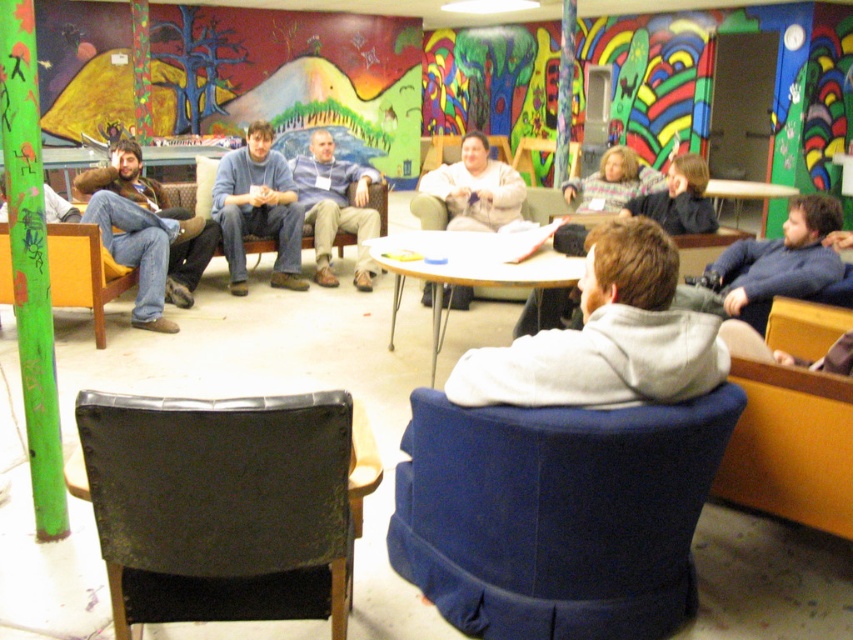
Between black leather swivel chair at lower left and matte blue jeans at center, which one is positioned higher?

matte blue jeans at center is higher up.

Between black leather swivel chair at lower left and matte blue jeans at center, which one has less height?

Standing shorter between the two is black leather swivel chair at lower left.

Is point (334, 593) more distant than point (328, 272)?

No, it is in front of (328, 272).

The image size is (853, 640). I want to click on black leather swivel chair at lower left, so click(x=222, y=504).

Can you confirm if black leather swivel chair at lower left is positioned below white glossy table at center?

Yes.

Does point (218, 424) lie behind point (727, 189)?

No, it is not.

Image resolution: width=853 pixels, height=640 pixels. Describe the element at coordinates (222, 504) in the screenshot. I see `black leather swivel chair at lower left` at that location.

This screenshot has height=640, width=853. Find the location of `black leather swivel chair at lower left`. black leather swivel chair at lower left is located at coordinates 222,504.

Does point (555, 424) come closer to viewer compared to point (341, 179)?

Yes.

Who is more forward, (611, 627) or (323, 243)?

Point (611, 627) is in front.

Which is in front, point (718, 403) or point (367, 280)?

Point (718, 403) is in front.

This screenshot has width=853, height=640. Identify the location of blue fabric swivel chair at center. (556, 513).